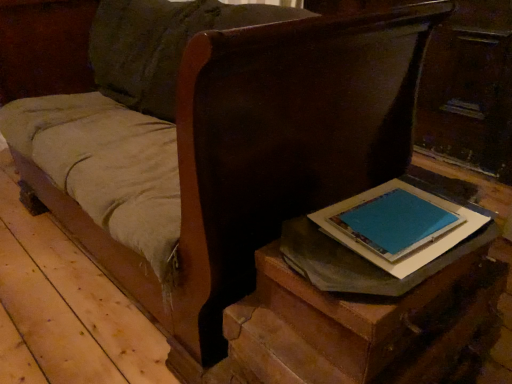
Where is `free space above matte brown table at lower right (from a real-world perspective)`? The width and height of the screenshot is (512, 384). free space above matte brown table at lower right (from a real-world perspective) is located at coordinates (393, 223).